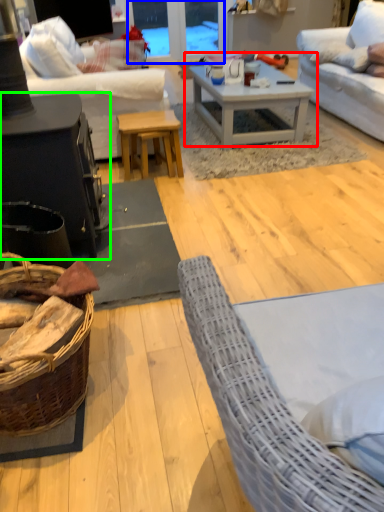
Question: Estimate the real-world distances between objects in this image. Which object is closer to coffee table (highlighted by a red box), glass door (highlighted by a blue box) or table (highlighted by a green box)?

Choices:
 (A) glass door
 (B) table

Answer: (B)